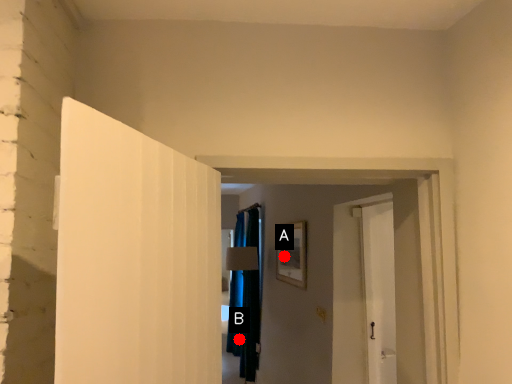
Question: Two points are circled on the image, labeled by A and B beside each circle. Which point is closer to the camera?

Choices:
 (A) A is closer
 (B) B is closer

Answer: (A)